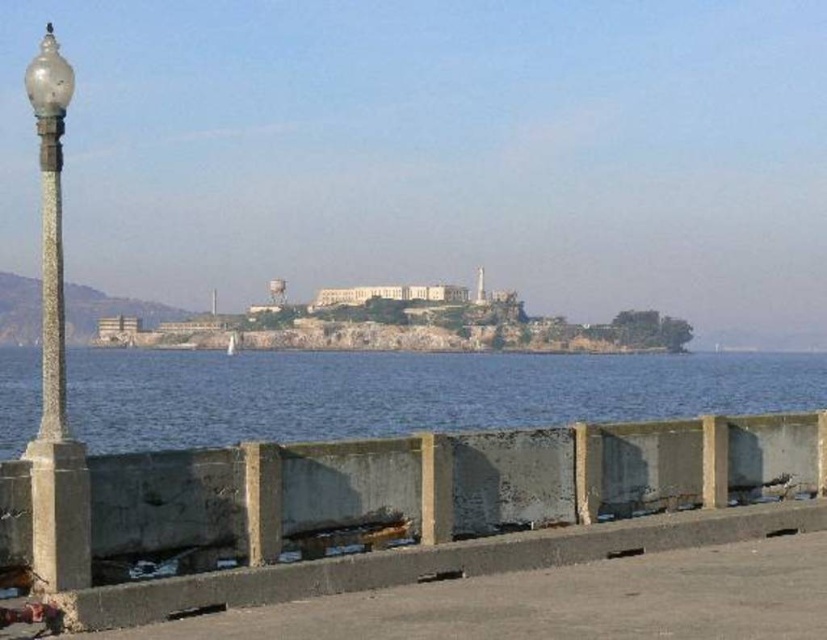
You are standing on a walkway and see the blue water at lower center and the concrete at lower center. Which one is higher from the ground?

The blue water at lower center is taller than the concrete at lower center, so it is higher from the ground.

You are standing on a walkway and see the concrete at lower center and the matte glass lamp post at left. Which object is closer to your right side?

The concrete at lower center is positioned on the right side of the matte glass lamp post at left, so the concrete at lower center is closer to your right side.

You are standing on the concrete at lower center. If you walk straight ahead, will you fall into the water?

Yes, because the concrete at lower center is at point (443, 570), which is near the edge leading to the water.